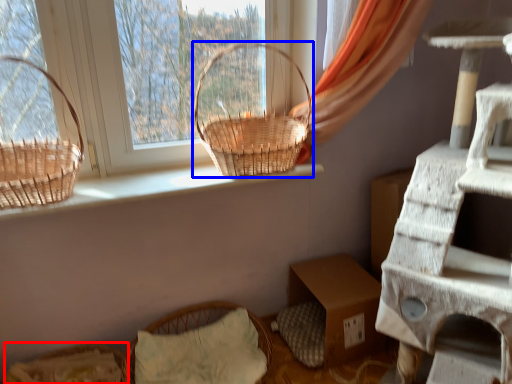
Question: Which object is closer to the camera taking this photo, flower basket (highlighted by a red box) or picnic basket (highlighted by a blue box)?

Choices:
 (A) flower basket
 (B) picnic basket

Answer: (A)